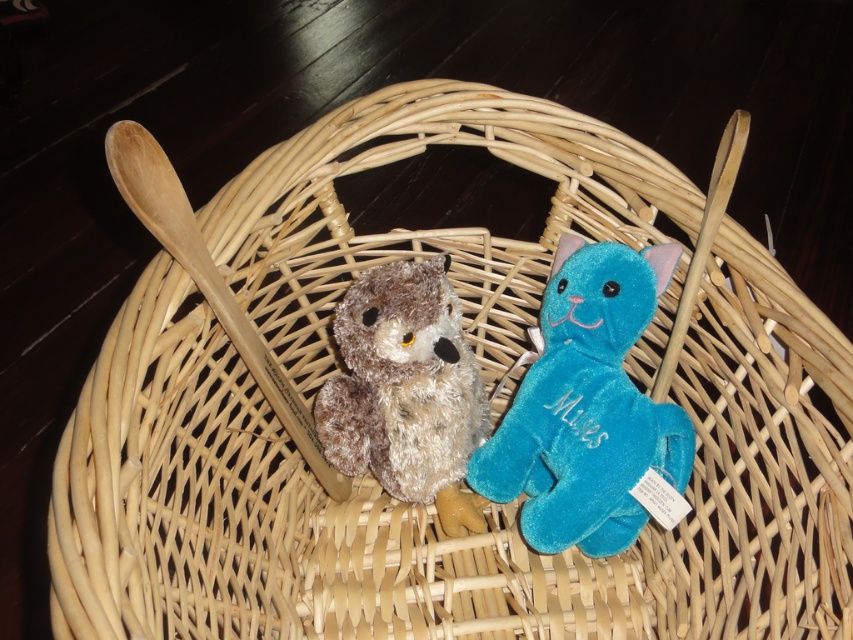
You are organizing a childrens party and need to place a small toy car exactly at the center of the wicker basket. Given the current arrangement of the velvet blue cat at center, where should you position the toy car to ensure it is centered?

The velvet blue cat at center is located at point (590, 410), so to place the toy car exactly at the center of the wicker basket, you should position it at the basket center point, which may require adjusting the velvet blue cat at center slightly to make space.

You are a toy organizer who needs to place a new toy between the velvet blue cat at center and the fuzzy brown owl at center. The new toy is 10 centimeters long. Can you fit it between them without moving the existing toys?

The velvet blue cat at center and the fuzzy brown owl at center are 10.69 centimeters apart. Since the new toy is 10 centimeters long, it can fit between them without moving the existing toys as there is enough space.

You are standing in front of the wicker basket on the dark wooden surface. You want to find the velvet blue cat named Miles. Which object corresponds to the point marked as point (590, 410)?

The velvet blue cat at center corresponds to the point marked as point (590, 410).